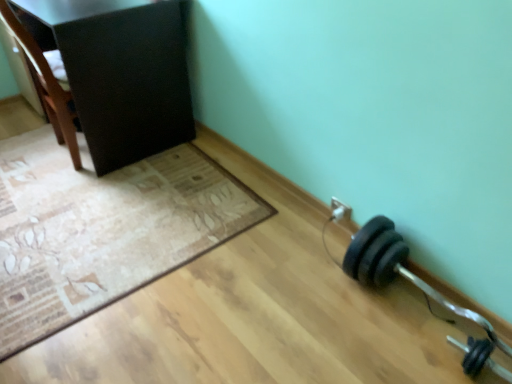
Identify the location of free space that is to the left of black rubber dumbbell at lower right, which is the 1th dumbbell from top to bottom. Image resolution: width=512 pixels, height=384 pixels. [315, 316].